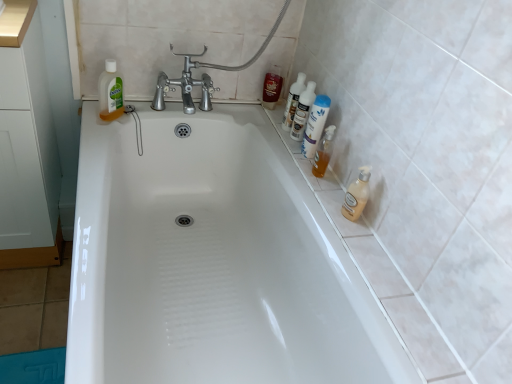
Find the location of a particular element. translucent beige pump bottle at right, placed as the fourth cleaning product when sorted from left to right is located at coordinates pyautogui.click(x=357, y=195).

This screenshot has height=384, width=512. Describe the element at coordinates (323, 152) in the screenshot. I see `translucent plastic bottle at right, the first toiletry in the bottom-to-top sequence` at that location.

This screenshot has width=512, height=384. What do you see at coordinates (303, 111) in the screenshot? I see `white glossy bottles at upper right, the 2th toiletry in the front-to-back sequence` at bounding box center [303, 111].

Image resolution: width=512 pixels, height=384 pixels. Find the location of `translucent plastic bottle at upper right, acting as the 2th cleaning product starting from the right`. translucent plastic bottle at upper right, acting as the 2th cleaning product starting from the right is located at coordinates (315, 125).

How much space does translucent plastic bottle at upper left, the first cleaning product when ordered from left to right, occupy horizontally?

It is 1.94 inches.

Image resolution: width=512 pixels, height=384 pixels. I want to click on translucent beige pump bottle at right, which is counted as the 1th cleaning product, starting from the right, so (357, 195).

Considering the sizes of objects shiny red can at upper right, which is the third toiletry from bottom to top, and translucent beige pump bottle at right, which is counted as the 1th cleaning product, starting from the right, in the image provided, who is wider, shiny red can at upper right, which is the third toiletry from bottom to top, or translucent beige pump bottle at right, which is counted as the 1th cleaning product, starting from the right,?

With larger width is translucent beige pump bottle at right, which is counted as the 1th cleaning product, starting from the right.

In order to click on toiletry that is the 2nd object directly below the translucent beige pump bottle at right, placed as the fourth cleaning product when sorted from left to right (from a real-world perspective) in this screenshot , I will do pos(272,87).

Considering the positions of objects shiny red can at upper right, the first toiletry positioned from the back, and translucent beige pump bottle at right, which is counted as the 1th cleaning product, starting from the right, in the image provided, who is more to the left, shiny red can at upper right, the first toiletry positioned from the back, or translucent beige pump bottle at right, which is counted as the 1th cleaning product, starting from the right,?

From the viewer's perspective, shiny red can at upper right, the first toiletry positioned from the back, appears more on the left side.

From the image's perspective, does shiny red can at upper right, positioned as the 1th toiletry in left-to-right order, appear higher than translucent beige pump bottle at right, placed as the fourth cleaning product when sorted from left to right?

Yes, from the image's perspective, shiny red can at upper right, positioned as the 1th toiletry in left-to-right order, is on top of translucent beige pump bottle at right, placed as the fourth cleaning product when sorted from left to right.

From the image's perspective, is translucent plastic bottles at upper right, marked as the 3th cleaning product in a right-to-left arrangement, on top of translucent plastic bottle at right, marked as the 1th toiletry in a front-to-back arrangement?

Yes, from the image's perspective, translucent plastic bottles at upper right, marked as the 3th cleaning product in a right-to-left arrangement, is over translucent plastic bottle at right, marked as the 1th toiletry in a front-to-back arrangement.

Are translucent plastic bottles at upper right, marked as the 3th cleaning product in a right-to-left arrangement, and translucent plastic bottle at right, the third toiletry in the left-to-right sequence, far apart?

No, translucent plastic bottles at upper right, marked as the 3th cleaning product in a right-to-left arrangement, is not far from translucent plastic bottle at right, the third toiletry in the left-to-right sequence.

Considering the sizes of translucent plastic bottles at upper right, marked as the 3th cleaning product in a right-to-left arrangement, and translucent plastic bottle at right, the first toiletry in the bottom-to-top sequence, in the image, is translucent plastic bottles at upper right, marked as the 3th cleaning product in a right-to-left arrangement, taller or shorter than translucent plastic bottle at right, the first toiletry in the bottom-to-top sequence,?

Clearly, translucent plastic bottles at upper right, marked as the 3th cleaning product in a right-to-left arrangement, is taller compared to translucent plastic bottle at right, the first toiletry in the bottom-to-top sequence.

This screenshot has height=384, width=512. I want to click on the 2nd toiletry in front when counting from the translucent plastic bottles at upper right, marked as the 3th cleaning product in a right-to-left arrangement, so [x=323, y=152].

Who is bigger, translucent plastic bottle at upper right, the 3th cleaning product when ordered from left to right, or white matte cabinet at left?

white matte cabinet at left.

Are translucent plastic bottle at upper right, the 3th cleaning product when ordered from left to right, and white matte cabinet at left far apart?

No, translucent plastic bottle at upper right, the 3th cleaning product when ordered from left to right, is not far away from white matte cabinet at left.

Locate an element on the screen. cabinetry in front of the translucent plastic bottle at upper right, acting as the 2th cleaning product starting from the right is located at coordinates (26, 145).

Based on the photo, in terms of height, does translucent plastic bottle at upper right, the 3th cleaning product when ordered from left to right, look taller or shorter compared to white matte cabinet at left?

Considering their sizes, translucent plastic bottle at upper right, the 3th cleaning product when ordered from left to right, has less height than white matte cabinet at left.

Is white glossy bathtub at center far away from white matte cabinet at left?

They are positioned close to each other.

Choose the correct answer: Is white glossy bathtub at center inside white matte cabinet at left or outside it?

white glossy bathtub at center is not inside white matte cabinet at left, it's outside.

Does point (180, 305) lie behind point (42, 92)?

Yes, it is.

Considering the relative sizes of translucent plastic bottles at upper right, marked as the 3th cleaning product in a right-to-left arrangement, and translucent beige pump bottle at right, placed as the fourth cleaning product when sorted from left to right, in the image provided, is translucent plastic bottles at upper right, marked as the 3th cleaning product in a right-to-left arrangement, smaller than translucent beige pump bottle at right, placed as the fourth cleaning product when sorted from left to right,?

No, translucent plastic bottles at upper right, marked as the 3th cleaning product in a right-to-left arrangement, is not smaller than translucent beige pump bottle at right, placed as the fourth cleaning product when sorted from left to right.

Considering the relative sizes of translucent plastic bottles at upper right, the 2th cleaning product positioned from the left, and translucent beige pump bottle at right, placed as the fourth cleaning product when sorted from left to right, in the image provided, is translucent plastic bottles at upper right, the 2th cleaning product positioned from the left, shorter than translucent beige pump bottle at right, placed as the fourth cleaning product when sorted from left to right,?

In fact, translucent plastic bottles at upper right, the 2th cleaning product positioned from the left, may be taller than translucent beige pump bottle at right, placed as the fourth cleaning product when sorted from left to right.

From the translucent plastic bottles at upper right, marked as the 3th cleaning product in a right-to-left arrangement, count 2nd cleaning product to the right and point to it. Please provide its 2D coordinates.

[(357, 195)]

How much distance is there between translucent plastic bottles at upper right, the 2th cleaning product positioned from the left, and translucent beige pump bottle at right, which is counted as the 1th cleaning product, starting from the right?

A distance of 17.34 inches exists between translucent plastic bottles at upper right, the 2th cleaning product positioned from the left, and translucent beige pump bottle at right, which is counted as the 1th cleaning product, starting from the right.

Considering the positions of point (268, 85) and point (101, 95), is point (268, 85) closer or farther from the camera than point (101, 95)?

Point (268, 85).

Considering the relative positions of shiny red can at upper right, which is the third toiletry from bottom to top, and translucent plastic bottle at upper left, acting as the 4th cleaning product starting from the right, in the image provided, is shiny red can at upper right, which is the third toiletry from bottom to top, behind translucent plastic bottle at upper left, acting as the 4th cleaning product starting from the right,?

Yes, the depth of shiny red can at upper right, which is the third toiletry from bottom to top, is greater than that of translucent plastic bottle at upper left, acting as the 4th cleaning product starting from the right.

What's the angular difference between shiny red can at upper right, which is the third toiletry from front to back, and translucent plastic bottle at upper left, acting as the 4th cleaning product starting from the right,'s facing directions?

There is a 65.9-degree angle between the facing directions of shiny red can at upper right, which is the third toiletry from front to back, and translucent plastic bottle at upper left, acting as the 4th cleaning product starting from the right.

From a real-world perspective, between shiny red can at upper right, the first toiletry positioned from the back, and translucent plastic bottle at upper left, acting as the 4th cleaning product starting from the right, who is vertically lower?

shiny red can at upper right, the first toiletry positioned from the back, from a real-world perspective.

Is point (319, 173) positioned after point (288, 118)?

That is False.

Between translucent plastic bottle at right, marked as the 1th toiletry in a front-to-back arrangement, and translucent plastic bottles at upper right, the 2th cleaning product positioned from the left, which one appears on the right side from the viewer's perspective?

From the viewer's perspective, translucent plastic bottle at right, marked as the 1th toiletry in a front-to-back arrangement, appears more on the right side.

This screenshot has width=512, height=384. I want to click on cleaning product that is the 3rd object located behind the translucent plastic bottle at right, the first toiletry in the bottom-to-top sequence, so click(x=293, y=101).

From the image's perspective, is translucent plastic bottle at right, which is the 3th toiletry from top to bottom, located above or below translucent plastic bottles at upper right, marked as the 3th cleaning product in a right-to-left arrangement?

From the image's perspective, translucent plastic bottle at right, which is the 3th toiletry from top to bottom, appears below translucent plastic bottles at upper right, marked as the 3th cleaning product in a right-to-left arrangement.

From the image's perspective, starting from the shiny red can at upper right, which is the third toiletry from bottom to top, which cleaning product is the 4th one below? Please provide its 2D coordinates.

[(357, 195)]

You are a GUI agent. You are given a task and a screenshot of the screen. Output one action in this format:
    pyautogui.click(x=<x>, y=<y>)
    Task: Click on the cleaning product that is the 2nd one when counting leftward from the translucent plastic bottle at right, the first toiletry in the bottom-to-top sequence
    The width and height of the screenshot is (512, 384).
    Given the screenshot: What is the action you would take?
    pyautogui.click(x=293, y=101)

Considering their positions, is shiny red can at upper right, which is counted as the 1th toiletry, starting from the top, positioned closer to white glossy bottles at upper right, the second toiletry when ordered from bottom to top, than translucent plastic bottle at upper left, the first cleaning product when ordered from left to right?

Among the two, shiny red can at upper right, which is counted as the 1th toiletry, starting from the top, is located nearer to white glossy bottles at upper right, the second toiletry when ordered from bottom to top.

Which object lies further to the anchor point translucent plastic bottle at upper right, the 3th cleaning product when ordered from left to right, translucent plastic bottle at right, the 1th toiletry positioned from the right, or white matte cabinet at left?

Based on the image, white matte cabinet at left appears to be further to translucent plastic bottle at upper right, the 3th cleaning product when ordered from left to right.

In the scene shown: When comparing their distances from translucent plastic bottle at upper right, acting as the 2th cleaning product starting from the right, does shiny red can at upper right, which is the third toiletry from bottom to top, or white glossy bottles at upper right, which is the 2th toiletry in left-to-right order, seem closer?

white glossy bottles at upper right, which is the 2th toiletry in left-to-right order, lies closer to translucent plastic bottle at upper right, acting as the 2th cleaning product starting from the right, than the other object.

When comparing their distances from translucent plastic bottles at upper right, the 2th cleaning product positioned from the left, does white matte cabinet at left or translucent plastic bottle at upper right, acting as the 2th cleaning product starting from the right, seem closer?

Based on the image, translucent plastic bottle at upper right, acting as the 2th cleaning product starting from the right, appears to be nearer to translucent plastic bottles at upper right, the 2th cleaning product positioned from the left.

Estimate the real-world distances between objects in this image. Which object is closer to translucent plastic bottle at upper left, the first cleaning product when ordered from left to right, translucent plastic bottle at right, the third toiletry in the left-to-right sequence, or translucent plastic bottles at upper right, the 2th cleaning product positioned from the left?

Based on the image, translucent plastic bottles at upper right, the 2th cleaning product positioned from the left, appears to be nearer to translucent plastic bottle at upper left, the first cleaning product when ordered from left to right.

From the image, which object appears to be farther from translucent plastic bottles at upper right, the 2th cleaning product positioned from the left, white matte cabinet at left or translucent plastic bottle at upper left, the first cleaning product when ordered from left to right?

white matte cabinet at left lies further to translucent plastic bottles at upper right, the 2th cleaning product positioned from the left, than the other object.

Based on their spatial positions, is translucent plastic bottles at upper right, the 2th cleaning product positioned from the left, or white glossy bathtub at center further from white matte cabinet at left?

The object further to white matte cabinet at left is translucent plastic bottles at upper right, the 2th cleaning product positioned from the left.

Which object lies further to the anchor point shiny red can at upper right, positioned as the 1th toiletry in left-to-right order, translucent beige pump bottle at right, placed as the fourth cleaning product when sorted from left to right, or translucent plastic bottle at upper right, acting as the 2th cleaning product starting from the right?

translucent beige pump bottle at right, placed as the fourth cleaning product when sorted from left to right.

Image resolution: width=512 pixels, height=384 pixels. I want to click on toiletry between white glossy bathtub at center and translucent plastic bottle at upper right, acting as the 2th cleaning product starting from the right, along the z-axis, so click(323, 152).

At what (x,y) coordinates should I click in order to perform the action: click on bathtub located between white matte cabinet at left and translucent beige pump bottle at right, which is counted as the 1th cleaning product, starting from the right, in the left-right direction. Please return your answer as a coordinate pair (x, y). Image resolution: width=512 pixels, height=384 pixels. Looking at the image, I should click on (x=212, y=261).

You are a GUI agent. You are given a task and a screenshot of the screen. Output one action in this format:
    pyautogui.click(x=<x>, y=<y>)
    Task: Click on the bathtub situated between translucent plastic bottle at upper left, the first cleaning product when ordered from left to right, and translucent beige pump bottle at right, placed as the fourth cleaning product when sorted from left to right, from left to right
    
    Given the screenshot: What is the action you would take?
    pyautogui.click(x=212, y=261)

You are a GUI agent. You are given a task and a screenshot of the screen. Output one action in this format:
    pyautogui.click(x=<x>, y=<y>)
    Task: Click on the bathtub located between white matte cabinet at left and translucent plastic bottle at upper right, the 3th cleaning product when ordered from left to right, in the left-right direction
    
    Given the screenshot: What is the action you would take?
    pyautogui.click(x=212, y=261)